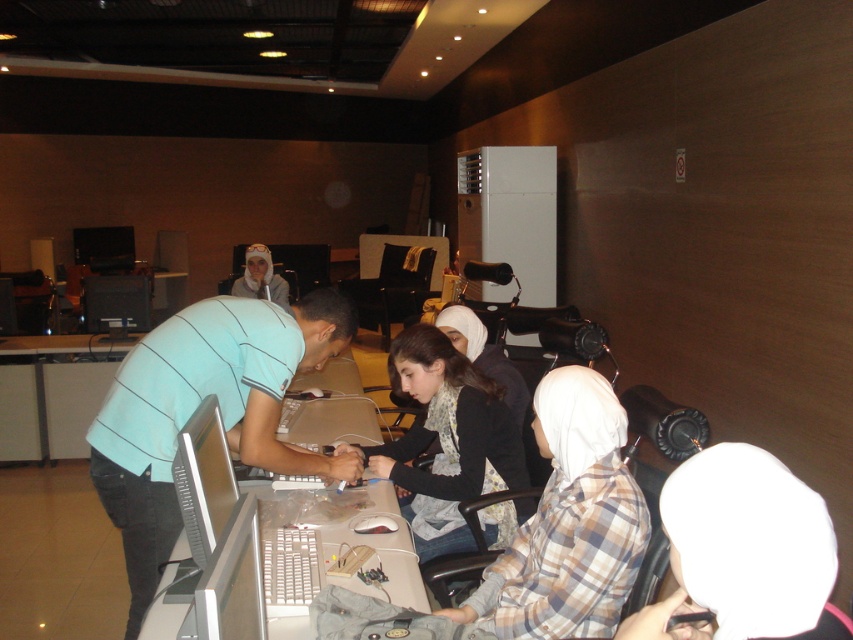
Question: Is matte silver monitor at center to the left of white plastic computer at center from the viewer's perspective?

Choices:
 (A) no
 (B) yes

Answer: (A)

Question: Does light blue striped shirt at center lie behind matte white hijab at center?

Choices:
 (A) no
 (B) yes

Answer: (A)

Question: Among these objects, which one is farthest from the camera?

Choices:
 (A) plaid fabric shirt at center
 (B) matte white hijab at center
 (C) white matte headscarf at lower right
 (D) white plastic computer at center

Answer: (B)

Question: Among these objects, which one is nearest to the camera?

Choices:
 (A) white matte headscarf at lower right
 (B) matte silver monitor at center
 (C) matte plastic monitor at center

Answer: (A)

Question: Can you confirm if light blue striped shirt at center is positioned to the left of white plastic computer at center?

Choices:
 (A) no
 (B) yes

Answer: (B)

Question: Which point is closer to the camera?

Choices:
 (A) (480, 600)
 (B) (283, 278)
 (C) (190, 426)

Answer: (C)